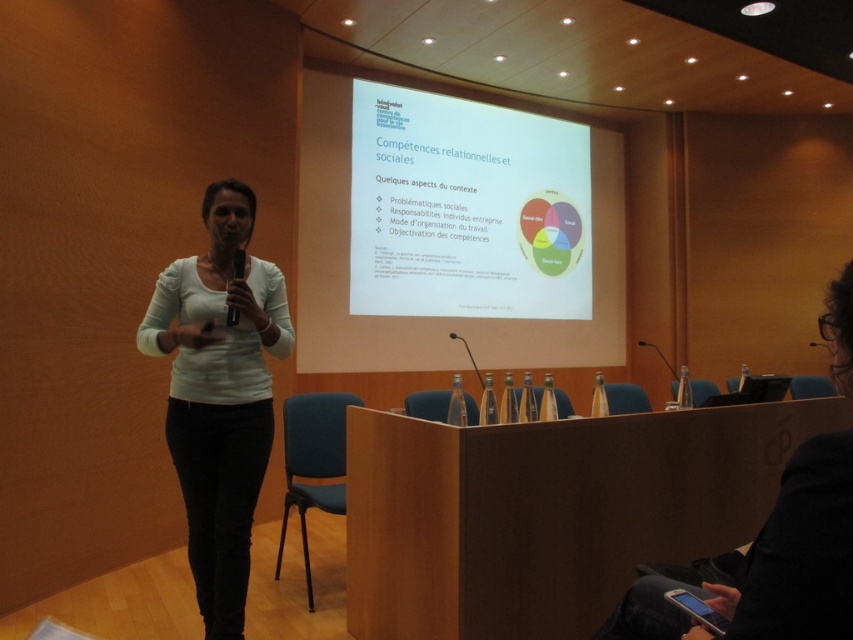
Who is more forward, (274, 294) or (326, 131)?

Positioned in front is point (274, 294).

Measure the distance between white matte shirt at center and camera.

7.49 feet

Where is `white matte shirt at center`? white matte shirt at center is located at coordinates tap(219, 394).

Which is behind, point (596, 136) or point (630, 604)?

The point (596, 136) is behind.

Is white matte projection screen at upper center wider than black fabric jacket at lower right?

Yes, white matte projection screen at upper center is wider than black fabric jacket at lower right.

At what (x,y) coordinates should I click in order to perform the action: click on white matte projection screen at upper center. Please return your answer as a coordinate pair (x, y). The width and height of the screenshot is (853, 640). Looking at the image, I should click on (434, 320).

Is white matte shirt at center positioned in front of black fabric jacket at lower right?

No, it is not.

Does white matte shirt at center appear on the left side of black fabric jacket at lower right?

Yes, white matte shirt at center is to the left of black fabric jacket at lower right.

Describe the element at coordinates (219, 394) in the screenshot. I see `white matte shirt at center` at that location.

Where is `white matte shirt at center`? Image resolution: width=853 pixels, height=640 pixels. white matte shirt at center is located at coordinates click(219, 394).